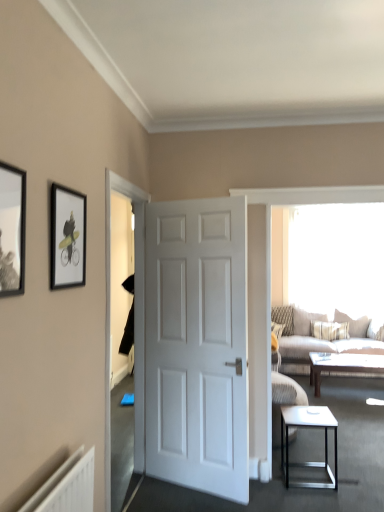
Question: Is matte black picture frame at upper left, acting as the 2th picture frame starting from the front, inside the boundaries of textured beige fabric couch at right, or outside?

Choices:
 (A) outside
 (B) inside

Answer: (A)

Question: Is matte black picture frame at upper left, which is the 1th picture frame in right-to-left order, wider or thinner than textured beige fabric couch at right?

Choices:
 (A) thin
 (B) wide

Answer: (A)

Question: Based on their relative distances, which object is farther from the matte black picture frame at upper left, the first picture frame when ordered from back to front?

Choices:
 (A) patterned fabric pillow at right, acting as the first pillow starting from the left
 (B) white matte door at center
 (C) matte black picture frame at left, the second picture frame from the right
 (D) brown wooden coffee table at center
 (E) textured beige fabric couch at right

Answer: (A)

Question: Considering the real-world distances, which object is farthest from the transparent glass window screen at upper right?

Choices:
 (A) matte black picture frame at left, acting as the first picture frame starting from the left
 (B) matte black picture frame at upper left, the first picture frame when ordered from back to front
 (C) white glossy door at center
 (D) white glossy side table at lower right
 (E) beige textured pillow at right, arranged as the second pillow when viewed from the left

Answer: (A)